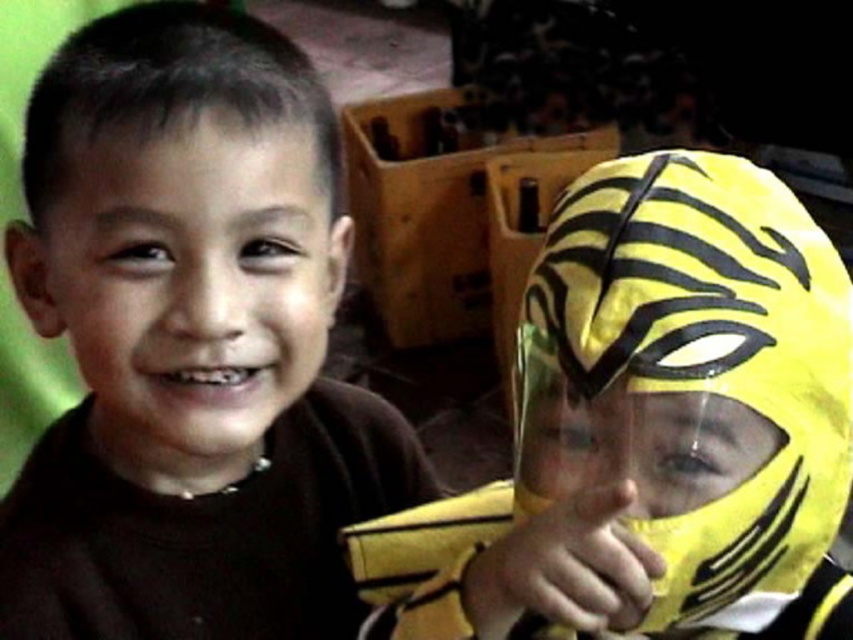
Question: Which object appears farthest from the camera in this image?

Choices:
 (A) brown matte shirt at center
 (B) yellow fabric mask at right
 (C) matte brown face at left

Answer: (A)

Question: From the image, what is the correct spatial relationship of brown matte shirt at center in relation to yellow fabric mask at right?

Choices:
 (A) above
 (B) below

Answer: (A)

Question: Does brown matte shirt at center have a greater width compared to yellow fabric mask at right?

Choices:
 (A) no
 (B) yes

Answer: (A)

Question: Based on their relative distances, which object is farther from the matte brown face at left?

Choices:
 (A) yellow fabric mask at right
 (B) brown matte shirt at center

Answer: (A)

Question: Can you confirm if brown matte shirt at center is smaller than yellow fabric mask at right?

Choices:
 (A) yes
 (B) no

Answer: (B)

Question: Which object is farther from the camera taking this photo?

Choices:
 (A) yellow fabric mask at right
 (B) brown matte shirt at center

Answer: (B)